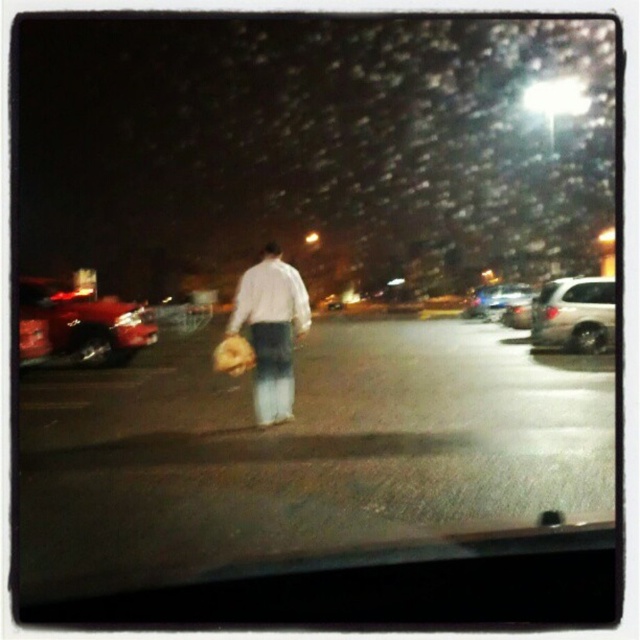
Can you confirm if shiny red car at left is wider than metallic silver sedan at right?

Yes.

Is point (120, 348) positioned after point (506, 316)?

No, (120, 348) is in front of (506, 316).

Identify the location of shiny red car at left. (88, 323).

Who is positioned more to the right, white matte shirt at center or shiny red car at left?

white matte shirt at center

Is point (276, 244) closer to camera compared to point (61, 355)?

Yes, it is.

Describe the element at coordinates (272, 330) in the screenshot. The width and height of the screenshot is (640, 640). I see `white matte shirt at center` at that location.

Find the location of a particular element. white matte shirt at center is located at coordinates (272, 330).

Who is more forward, (x=284, y=275) or (x=554, y=298)?

Point (x=284, y=275) is in front.

Is white matte shirt at center thinner than satin silver suv at right?

Yes, white matte shirt at center is thinner than satin silver suv at right.

Does point (275, 410) come in front of point (612, 304)?

Yes, point (275, 410) is in front of point (612, 304).

What are the coordinates of `white matte shirt at center` in the screenshot? It's located at (272, 330).